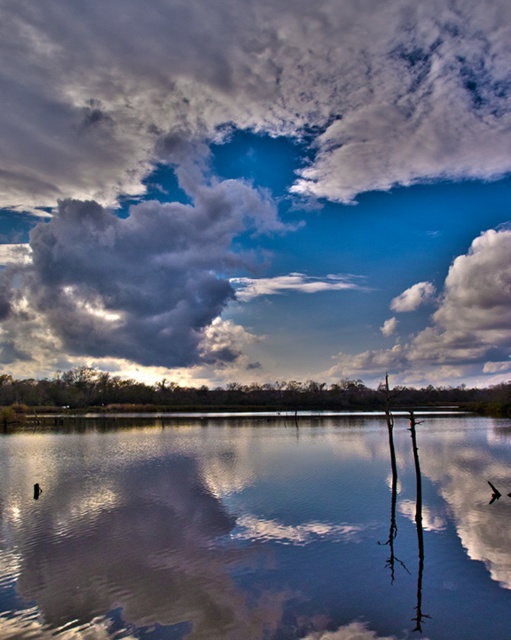
You are standing at the edge of the water and looking towards the center. Which object is positioned to the left of the other between the cloudy sky at upper center and the smooth reflective water at center?

The cloudy sky at upper center is positioned to the left of the smooth reflective water at center.

You are standing at the edge of the water and looking towards the center. Which object is above the other between the cloudy sky at upper center and the smooth reflective water at center?

The cloudy sky at upper center is positioned over the smooth reflective water at center, so the cloudy sky at upper center is above the smooth reflective water at center.

You are an artist planning to paint the scene. You want to ensure that the cloudy sky at upper center and the smooth reflective water at center are proportionally accurate. Which object should you make wider in your painting?

The cloudy sky at upper center should be made wider in the painting since its width is larger than the smooth reflective water at center according to the description.